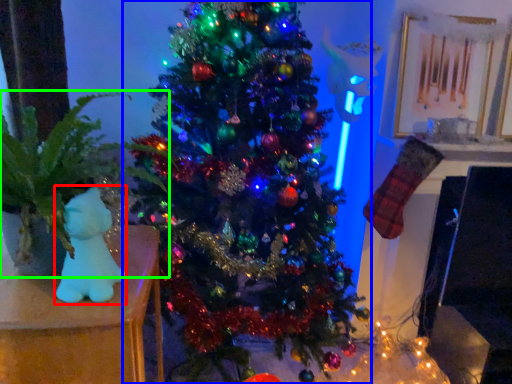
Question: Considering the real-world distances, which object is farthest from toy (highlighted by a red box)? christmas tree (highlighted by a blue box) or houseplant (highlighted by a green box)?

Choices:
 (A) christmas tree
 (B) houseplant

Answer: (A)